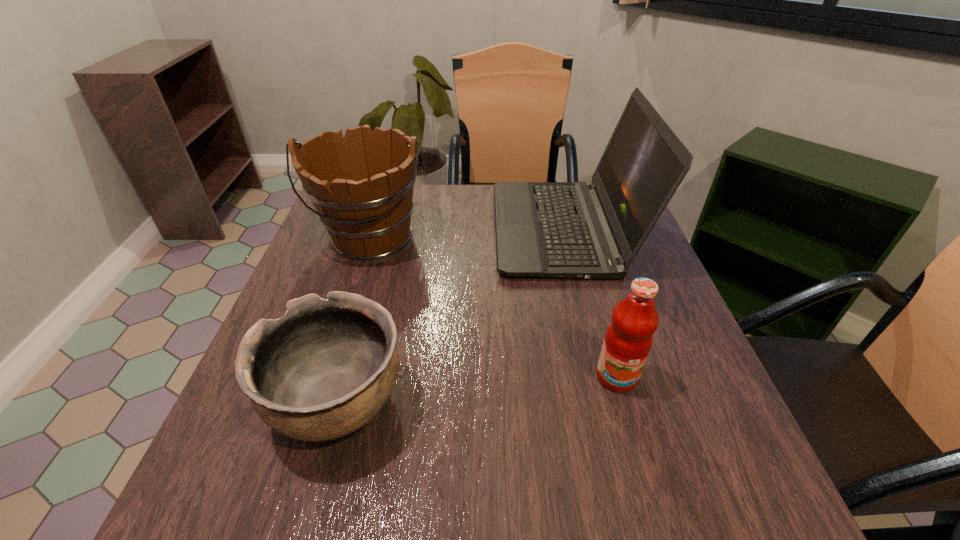
I want to click on laptop_computer that is at the far edge, so click(593, 230).

This screenshot has height=540, width=960. In order to click on wine bucket located at the far edge in this screenshot , I will do `click(361, 185)`.

The height and width of the screenshot is (540, 960). Find the location of `object at the near edge`. object at the near edge is located at coordinates (325, 369).

This screenshot has height=540, width=960. I want to click on wine bucket present at the left edge, so (361, 185).

Locate an element on the screen. This screenshot has width=960, height=540. pottery present at the left edge is located at coordinates (325, 369).

Locate an element on the screen. The width and height of the screenshot is (960, 540). laptop_computer located at the right edge is located at coordinates (593, 230).

Image resolution: width=960 pixels, height=540 pixels. Find the location of `fruit juice that is at the right edge`. fruit juice that is at the right edge is located at coordinates (628, 339).

Find the location of a particular element. This screenshot has height=540, width=960. object that is at the far left corner is located at coordinates (361, 185).

The width and height of the screenshot is (960, 540). In order to click on object that is at the near left corner in this screenshot , I will do `click(325, 369)`.

This screenshot has height=540, width=960. I want to click on object that is positioned at the far right corner, so click(593, 230).